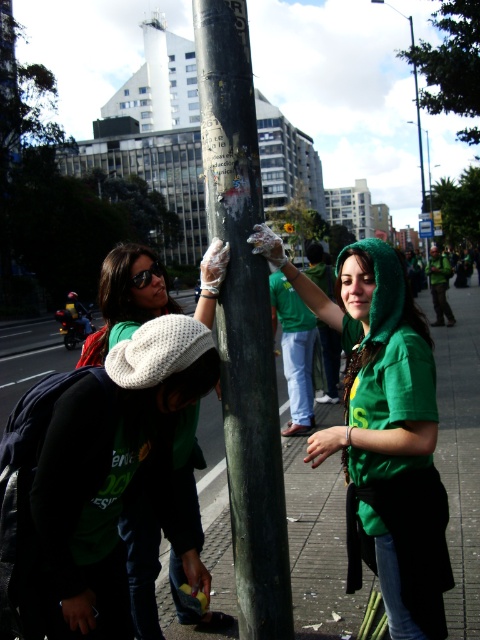
Question: Does brick pavement at center appear on the left side of blue plastic sign at upper center?

Choices:
 (A) no
 (B) yes

Answer: (B)

Question: Which point is farther to the camera?

Choices:
 (A) green shiny shirt at center
 (B) blue plastic sign at upper center

Answer: (B)

Question: Is metallic pole at upper center smaller than blue plastic sign at upper center?

Choices:
 (A) yes
 (B) no

Answer: (B)

Question: Among these points, which one is nearest to the camera?

Choices:
 (A) coord(372,368)
 (B) coord(432,232)
 (C) coord(384,3)
 (D) coord(254,566)

Answer: (A)

Question: Which of the following is the farthest from the observer?

Choices:
 (A) brick pavement at center
 (B) dark green textured pole at center
 (C) white knit hat at center

Answer: (A)

Question: Can you confirm if dark green textured pole at center is thinner than blue plastic sign at upper center?

Choices:
 (A) yes
 (B) no

Answer: (A)